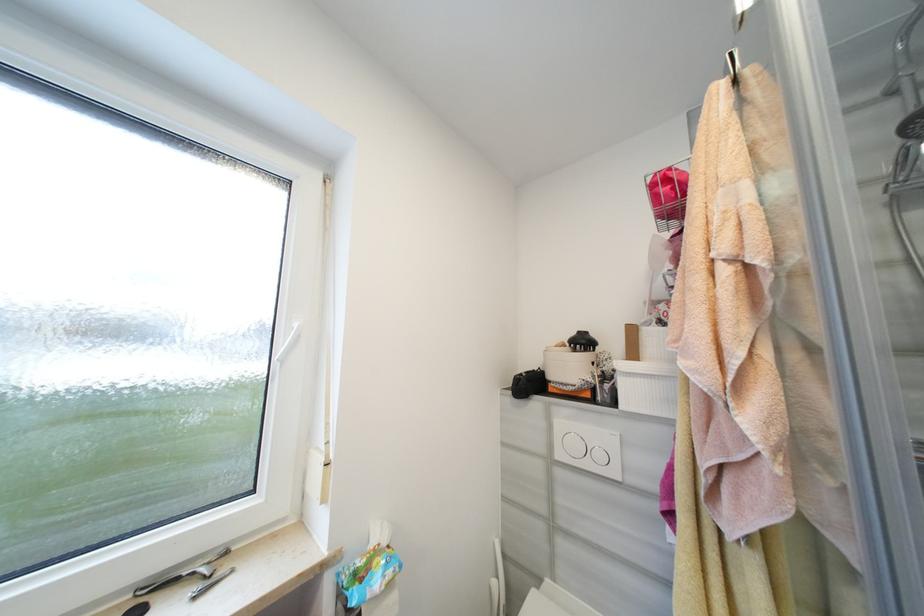
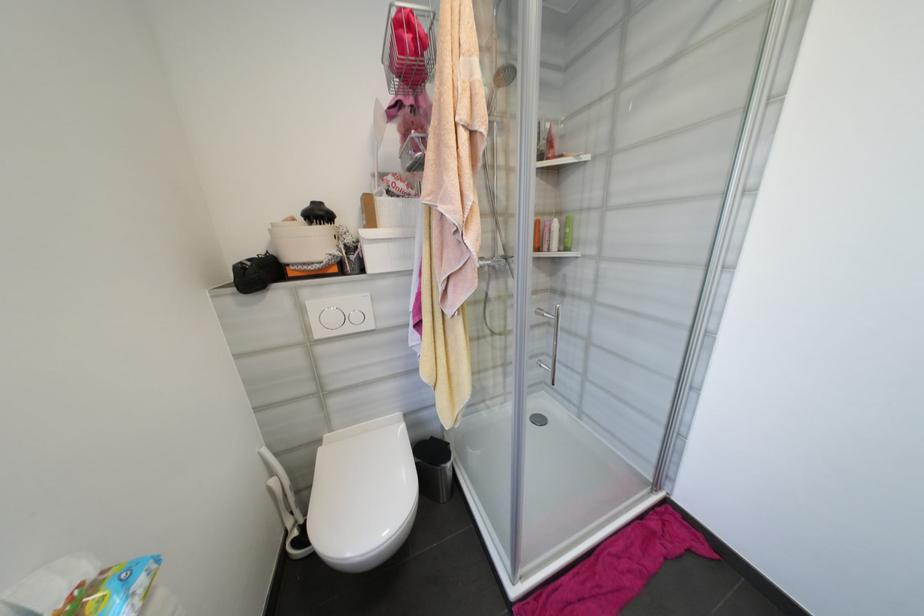
Locate, in the second image, the point that corresponds to point (500, 583) in the first image.

(277, 482)